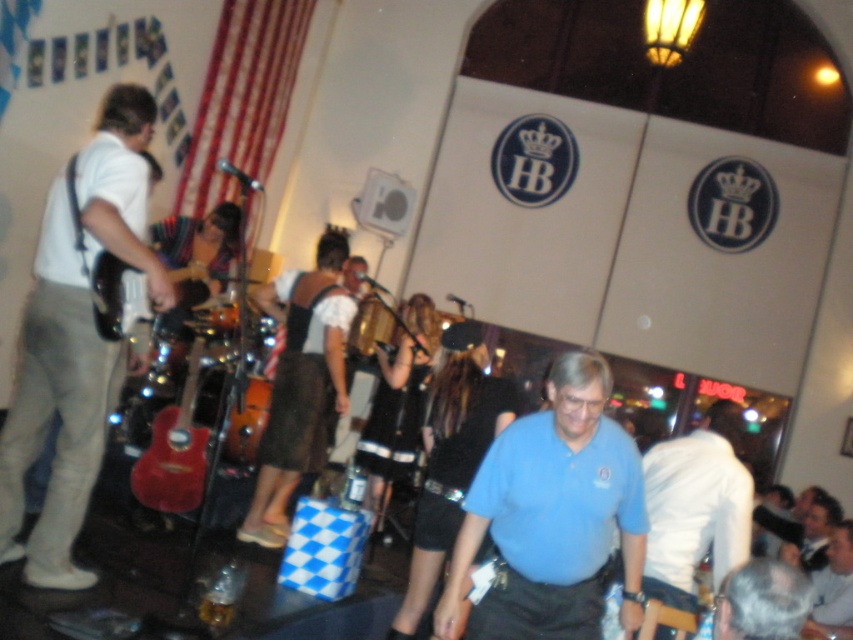
Where is `white matte guitar at left`? Image resolution: width=853 pixels, height=640 pixels. white matte guitar at left is located at coordinates (74, 339).

Image resolution: width=853 pixels, height=640 pixels. Find the location of `white matte guitar at left`. white matte guitar at left is located at coordinates (74, 339).

Is the position of blue cotton shirt at center less distant than that of white cotton shirt at center?

Yes, blue cotton shirt at center is closer to the viewer.

Which is more to the right, blue cotton shirt at center or white cotton shirt at center?

From the viewer's perspective, white cotton shirt at center appears more on the right side.

Is point (497, 442) farther from camera compared to point (698, 525)?

That is False.

At what (x,y) coordinates should I click in order to perform the action: click on blue cotton shirt at center. Please return your answer as a coordinate pair (x, y). This screenshot has width=853, height=640. Looking at the image, I should click on (552, 515).

Measure the distance from white cotton shirt at center to shiny red acoustic guitar at lower left.

white cotton shirt at center and shiny red acoustic guitar at lower left are 7.57 feet apart.

Between point (689, 449) and point (155, 420), which one is positioned behind?

The point (155, 420) is more distant.

Who is more distant from viewer, (747, 524) or (157, 435)?

Point (157, 435)

The height and width of the screenshot is (640, 853). What are the coordinates of `white cotton shirt at center` in the screenshot? It's located at (695, 508).